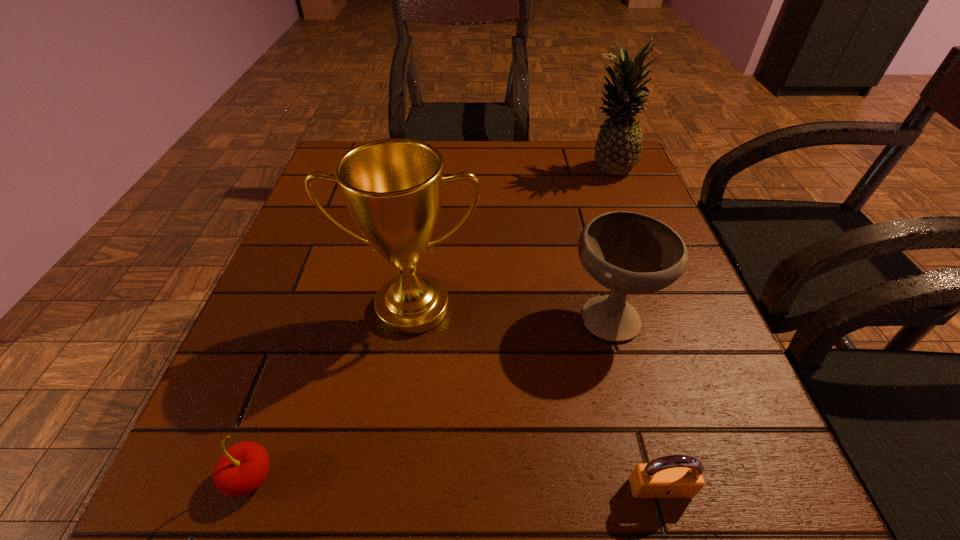
Locate an element on the screen. The height and width of the screenshot is (540, 960). object present at the far edge is located at coordinates (618, 147).

Identify the location of cherry positioned at the near edge. Image resolution: width=960 pixels, height=540 pixels. (242, 469).

At what (x,y) coordinates should I click in order to perform the action: click on padlock present at the near edge. Please return your answer as a coordinate pair (x, y). This screenshot has height=540, width=960. Looking at the image, I should click on (674, 476).

At what (x,y) coordinates should I click in order to perform the action: click on award that is at the left edge. Please return your answer as a coordinate pair (x, y). This screenshot has height=540, width=960. Looking at the image, I should click on (392, 187).

Identify the location of cherry at the left edge. Image resolution: width=960 pixels, height=540 pixels. (242, 469).

At what (x,y) coordinates should I click in order to perform the action: click on pineapple situated at the right edge. Please return your answer as a coordinate pair (x, y). Looking at the image, I should click on (618, 147).

Where is `chalice that is at the right edge`? The image size is (960, 540). chalice that is at the right edge is located at coordinates (629, 253).

Identify the location of padlock present at the right edge. (674, 476).

At what (x,y) coordinates should I click in order to perform the action: click on object located in the near left corner section of the desktop. Please return your answer as a coordinate pair (x, y). Image resolution: width=960 pixels, height=540 pixels. Looking at the image, I should click on (242, 469).

Where is `object that is at the far right corner`? The height and width of the screenshot is (540, 960). object that is at the far right corner is located at coordinates (618, 147).